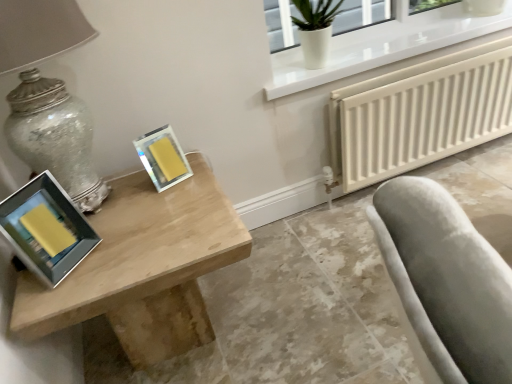
Locate an element on the screen. free location to the right of light wood table at left is located at coordinates (307, 287).